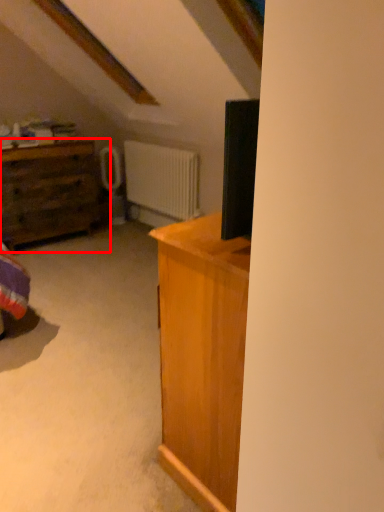
Question: From the image's perspective, considering the relative positions of chest of drawers (annotated by the red box) and radiator in the image provided, where is chest of drawers (annotated by the red box) located with respect to the staircase?

Choices:
 (A) below
 (B) above

Answer: (A)